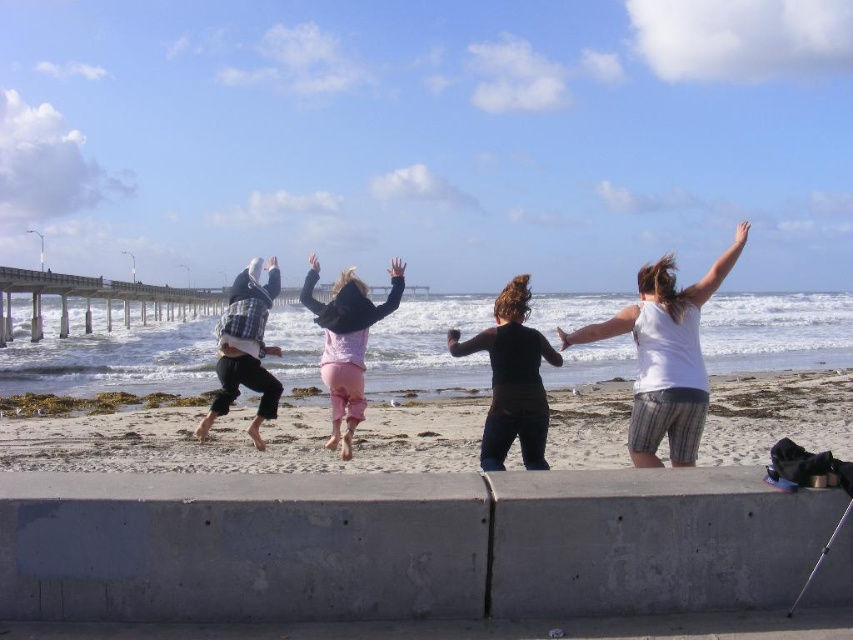
You are a photographer trying to capture a candid shot of the group. You notice the pink fleece jacket at center and the white matte arm at upper right. Which object should you focus on first if you want to photograph the smaller one?

The pink fleece jacket at center has a smaller size compared to the white matte arm at upper right, so you should focus on the pink fleece jacket at center first.

You are standing on the beach and see the white matte arm at upper center. If you want to reach it, in which direction should you walk from your current position?

The white matte arm at upper center is located at point coordinates of 0.512 on the x axis and 0.705 on the y axis. Since the y coordinate is higher than 0.5, it is positioned above the center of the image. To reach it, you should walk towards the upper part of the image from your current position.

In the scene shown: You are a photographer trying to capture the group of people jumping off the concrete ledge. You want to ensure that the pink fleece jacket at center and the white matte arm at upper right are both visible in the shot. Based on their positions, which object should you focus on first to frame the shot properly?

The pink fleece jacket at center is below the white matte arm at upper right, so you should focus on the white matte arm at upper right first to ensure it stays in frame as it is higher up.